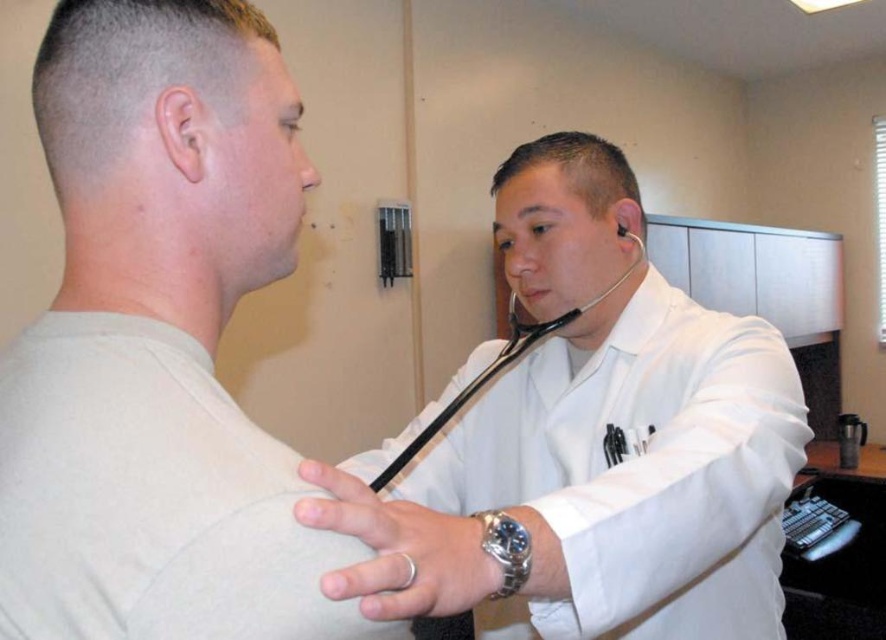
You are a medical student observing a doctor using two stethoscopes in the examination room. The doctor has a white smooth stethoscope at upper right and a black rubber stethoscope at upper center. Which stethoscope is nearer to you?

The white smooth stethoscope at upper right is closer to the viewer than the black rubber stethoscope at upper center, so the white smooth stethoscope at upper right is nearer to you.